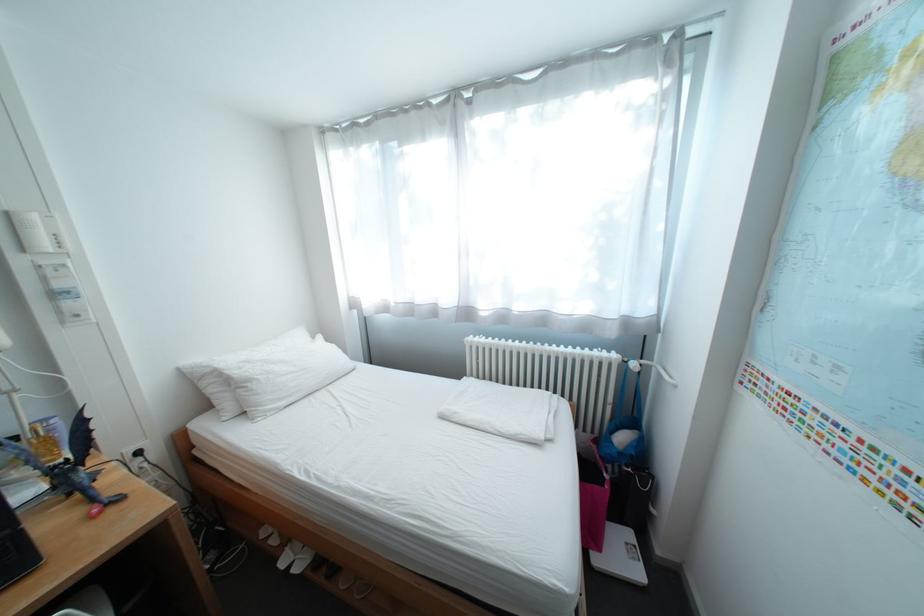
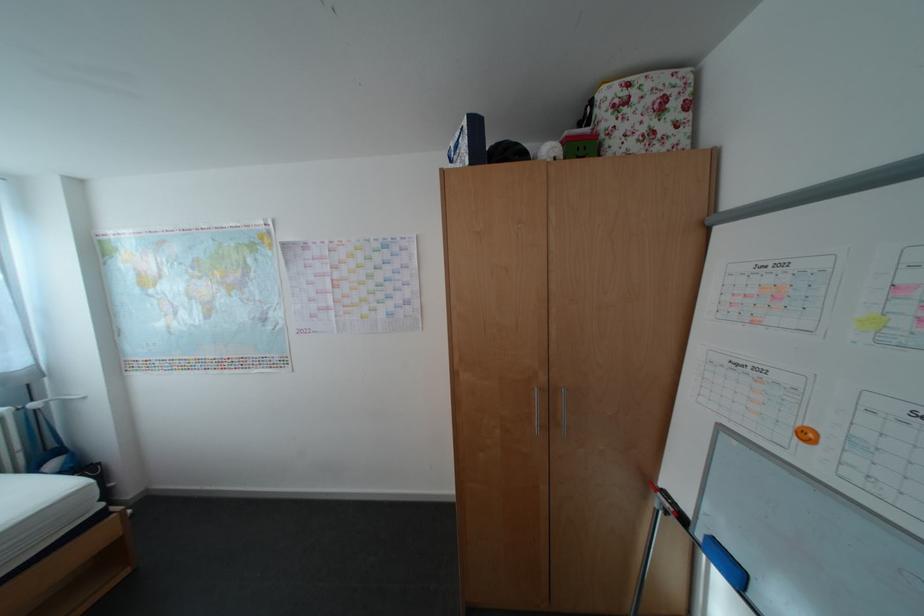
Locate, in the second image, the point that corresponds to the point at 649,416 in the first image.

(67, 447)